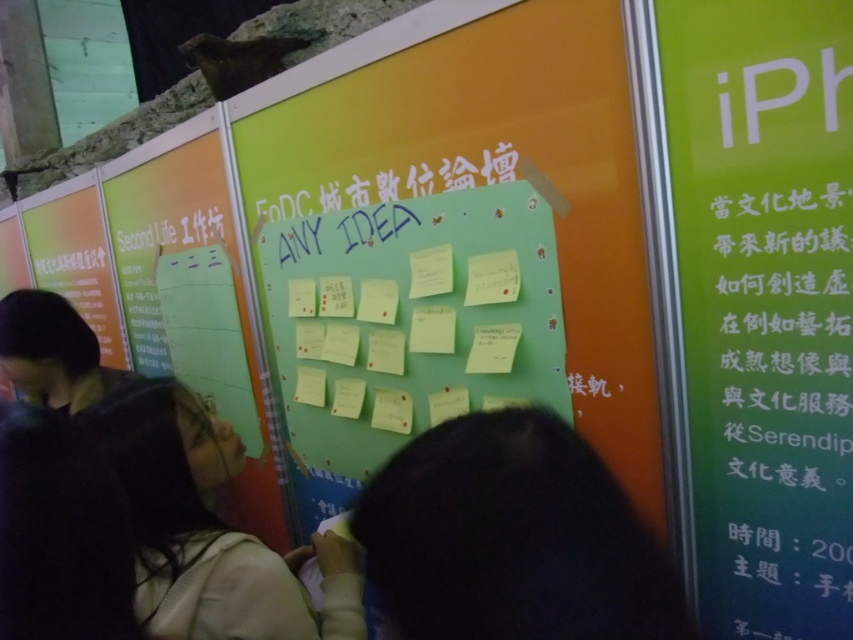
Which is more to the left, green paper at right or black fabric at lower left?

Positioned to the left is black fabric at lower left.

Consider the image. Can you confirm if green paper at right is taller than black fabric at lower left?

Yes, green paper at right is taller than black fabric at lower left.

In order to click on green paper at right in this screenshot , I will do point(764,305).

Who is positioned more to the right, green paper at right or green matte bulletin board at center?

Positioned to the right is green paper at right.

Does green paper at right have a lesser height compared to green matte bulletin board at center?

No.

Is point (785, 86) more distant than point (401, 320)?

No, it is in front of (401, 320).

You are a GUI agent. You are given a task and a screenshot of the screen. Output one action in this format:
    pyautogui.click(x=<x>, y=<y>)
    Task: Click on the green paper at right
    The image size is (853, 640).
    Given the screenshot: What is the action you would take?
    pyautogui.click(x=764, y=305)

What do you see at coordinates (409, 323) in the screenshot? The image size is (853, 640). I see `green matte bulletin board at center` at bounding box center [409, 323].

Is point (527, 298) more distant than point (51, 602)?

Yes, it is behind point (51, 602).

Locate an element on the screen. This screenshot has width=853, height=640. green matte bulletin board at center is located at coordinates (409, 323).